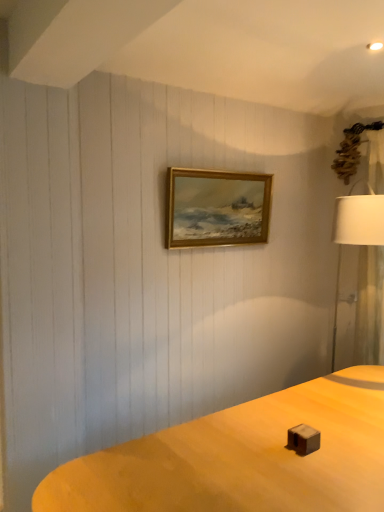
Describe the element at coordinates (216, 208) in the screenshot. I see `gold wooden picture frame at center` at that location.

This screenshot has height=512, width=384. What are the coordinates of `gold wooden picture frame at center` in the screenshot? It's located at (216, 208).

You are a GUI agent. You are given a task and a screenshot of the screen. Output one action in this format:
    pyautogui.click(x=<x>, y=<y>)
    Task: Click on the white fabric lampshade at right
    
    Given the screenshot: What is the action you would take?
    pyautogui.click(x=356, y=232)

The width and height of the screenshot is (384, 512). Describe the element at coordinates (356, 232) in the screenshot. I see `white fabric lampshade at right` at that location.

This screenshot has height=512, width=384. Identify the location of gold wooden picture frame at center. (216, 208).

In the image, is gold wooden picture frame at center on the left side or the right side of white fabric lampshade at right?

gold wooden picture frame at center is to the left of white fabric lampshade at right.

Which object is closer to the camera, gold wooden picture frame at center or white fabric lampshade at right?

white fabric lampshade at right is in front.

Is point (233, 234) closer or farther from the camera than point (341, 226)?

Point (233, 234) is farther from the camera than point (341, 226).

From the image's perspective, which one is positioned higher, gold wooden picture frame at center or white fabric lampshade at right?

gold wooden picture frame at center, from the image's perspective.

Consider the image. From a real-world perspective, is gold wooden picture frame at center positioned above or below white fabric lampshade at right?

gold wooden picture frame at center is above white fabric lampshade at right.

Based on the photo, which of these two, gold wooden picture frame at center or white fabric lampshade at right, is wider?

white fabric lampshade at right is wider.

Considering the sizes of objects gold wooden picture frame at center and white fabric lampshade at right in the image provided, who is shorter, gold wooden picture frame at center or white fabric lampshade at right?

With less height is gold wooden picture frame at center.

In the scene shown: Is gold wooden picture frame at center bigger or smaller than white fabric lampshade at right?

gold wooden picture frame at center is smaller than white fabric lampshade at right.

Does gold wooden picture frame at center contain white fabric lampshade at right?

Definitely not — white fabric lampshade at right is not inside gold wooden picture frame at center.

Is gold wooden picture frame at center far away from white fabric lampshade at right?

Actually, gold wooden picture frame at center and white fabric lampshade at right are a little close together.

Is gold wooden picture frame at center oriented towards white fabric lampshade at right?

No, gold wooden picture frame at center is not turned towards white fabric lampshade at right.

You are a GUI agent. You are given a task and a screenshot of the screen. Output one action in this format:
    pyautogui.click(x=<x>, y=<y>)
    Task: Click on the lamp that is below the gold wooden picture frame at center (from the image's perspective)
    Image resolution: width=384 pixels, height=512 pixels.
    Given the screenshot: What is the action you would take?
    pyautogui.click(x=356, y=232)

Between white fabric lampshade at right and gold wooden picture frame at center, which one appears on the right side from the viewer's perspective?

white fabric lampshade at right.

Is the depth of white fabric lampshade at right greater than that of gold wooden picture frame at center?

No, the depth of white fabric lampshade at right is less than that of gold wooden picture frame at center.

Does point (356, 227) come behind point (211, 186)?

That is False.

Based on the photo, from the image's perspective, which is below, white fabric lampshade at right or gold wooden picture frame at center?

white fabric lampshade at right, from the image's perspective.

Based on the photo, from a real-world perspective, between white fabric lampshade at right and gold wooden picture frame at center, who is vertically lower?

white fabric lampshade at right is physically lower.

Considering the sizes of white fabric lampshade at right and gold wooden picture frame at center in the image, is white fabric lampshade at right wider or thinner than gold wooden picture frame at center?

white fabric lampshade at right is wider than gold wooden picture frame at center.

Considering the relative sizes of white fabric lampshade at right and gold wooden picture frame at center in the image provided, is white fabric lampshade at right taller than gold wooden picture frame at center?

Yes, white fabric lampshade at right is taller than gold wooden picture frame at center.

In the scene shown: In terms of size, does white fabric lampshade at right appear bigger or smaller than gold wooden picture frame at center?

In the image, white fabric lampshade at right appears to be larger than gold wooden picture frame at center.

Do you think white fabric lampshade at right is within gold wooden picture frame at center, or outside of it?

white fabric lampshade at right is spatially situated outside gold wooden picture frame at center.

Would you say white fabric lampshade at right is a long distance from gold wooden picture frame at center?

No, white fabric lampshade at right is not far away from gold wooden picture frame at center.

Is white fabric lampshade at right turned away from gold wooden picture frame at center?

No, white fabric lampshade at right is not facing the opposite direction of gold wooden picture frame at center.

How distant is white fabric lampshade at right from gold wooden picture frame at center?

The distance of white fabric lampshade at right from gold wooden picture frame at center is 32.42 inches.

Locate an element on the screen. Image resolution: width=384 pixels, height=512 pixels. picture frame lying above the white fabric lampshade at right (from the image's perspective) is located at coordinates (216, 208).

Where is `picture frame on the left side of white fabric lampshade at right`? picture frame on the left side of white fabric lampshade at right is located at coordinates (216, 208).

Image resolution: width=384 pixels, height=512 pixels. Identify the location of lamp beneath the gold wooden picture frame at center (from a real-world perspective). (356, 232).